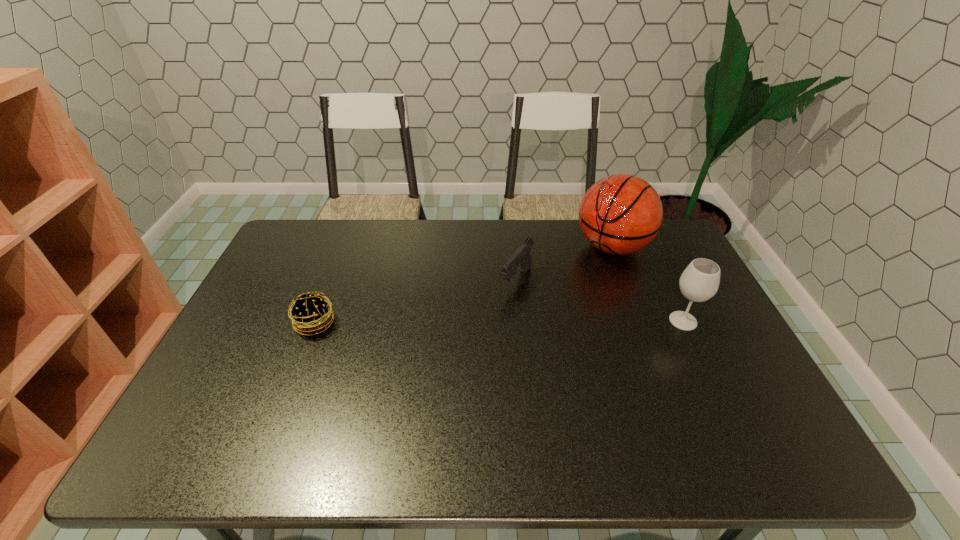
The height and width of the screenshot is (540, 960). Identify the location of patty. (311, 312).

Where is `the shortest object`? The width and height of the screenshot is (960, 540). the shortest object is located at coordinates (311, 312).

At what (x,y) coordinates should I click in order to perform the action: click on the second tallest object. Please return your answer as a coordinate pair (x, y). The image size is (960, 540). Looking at the image, I should click on (699, 282).

At what (x,y) coordinates should I click in order to perform the action: click on pistol. Please return your answer as a coordinate pair (x, y). Looking at the image, I should click on (522, 256).

Find the location of a particular element. The height and width of the screenshot is (540, 960). the second shortest object is located at coordinates (522, 256).

The width and height of the screenshot is (960, 540). In order to click on basketball in this screenshot , I will do `click(620, 214)`.

Locate an element on the screen. The width and height of the screenshot is (960, 540). vacant space situated on the right of the shortest object is located at coordinates (451, 323).

Find the location of a particular element. vacant space located on the back of the third shortest object is located at coordinates (660, 272).

Where is `free space located at the barrel of the second shortest object`? The image size is (960, 540). free space located at the barrel of the second shortest object is located at coordinates pos(459,356).

I want to click on blank space located 0.220m at the barrel of the second shortest object, so click(x=469, y=343).